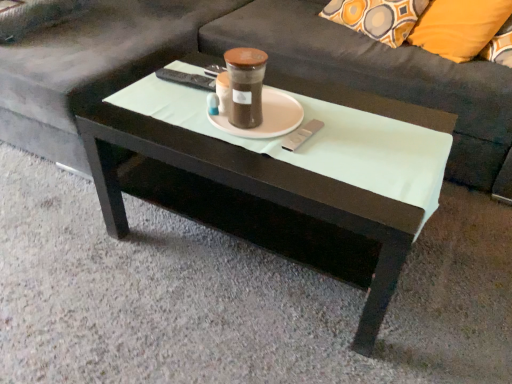
Identify the location of empty space that is to the right of brown matte glass jar at center. The image size is (512, 384). (328, 132).